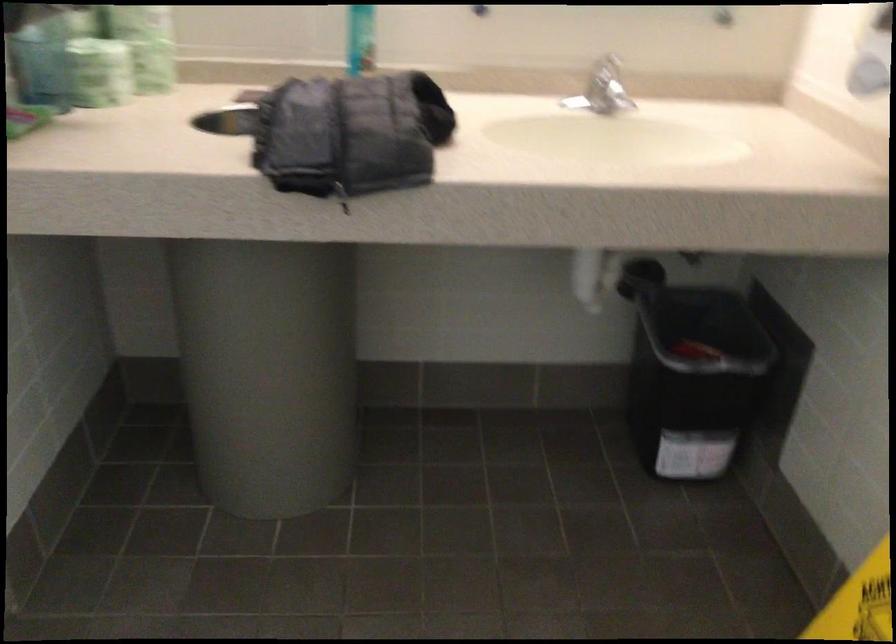
The image size is (896, 644). What are the coordinates of `black trash can` in the screenshot? It's located at (691, 373).